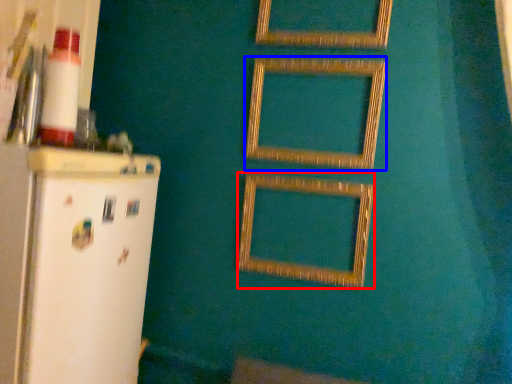
Question: Among these objects, which one is nearest to the camera, picture frame (highlighted by a red box) or picture frame (highlighted by a blue box)?

Choices:
 (A) picture frame
 (B) picture frame

Answer: (B)